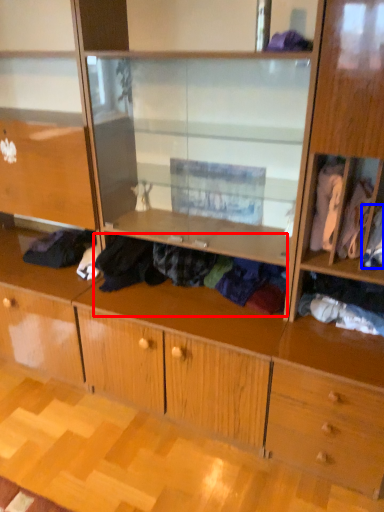
Question: Which of the following is the closest to the observer, clothing (highlighted by a red box) or clothing (highlighted by a blue box)?

Choices:
 (A) clothing
 (B) clothing

Answer: (B)